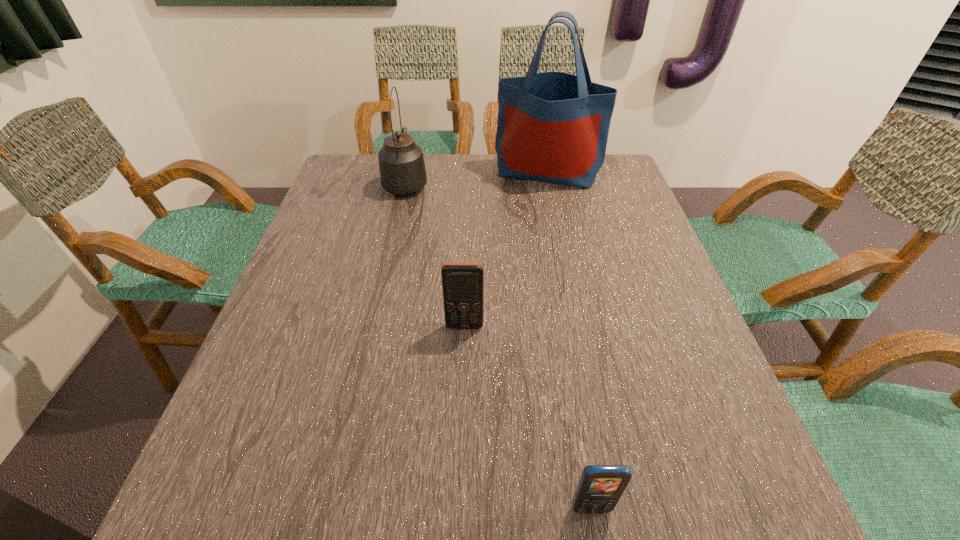
Find the location of `vacant area at the right edge`. vacant area at the right edge is located at coordinates (669, 360).

The width and height of the screenshot is (960, 540). In the image, there is a desktop. What are the coordinates of `vacant space at the far left corner` in the screenshot? It's located at (337, 187).

Where is `free location at the far right corner`? The image size is (960, 540). free location at the far right corner is located at coordinates (600, 190).

Where is `unoccupied position between the second nearest object and the tallest object`? The image size is (960, 540). unoccupied position between the second nearest object and the tallest object is located at coordinates (506, 249).

Identify the location of vacant area between the tallest object and the nearer cellular telephone. This screenshot has width=960, height=540. (568, 340).

Locate an element on the screen. The width and height of the screenshot is (960, 540). vacant point located between the second nearest object and the handbag is located at coordinates [506, 249].

I want to click on free point between the tallest object and the third object from right to left, so click(x=506, y=249).

The height and width of the screenshot is (540, 960). In order to click on blank region between the handbag and the third tallest object in this screenshot , I will do `click(506, 249)`.

Where is `vacant region between the shorter cellular telephone and the second nearest object`? The width and height of the screenshot is (960, 540). vacant region between the shorter cellular telephone and the second nearest object is located at coordinates (528, 417).

Image resolution: width=960 pixels, height=540 pixels. What are the coordinates of `free spot between the leftmost object and the taller cellular telephone` in the screenshot? It's located at (435, 254).